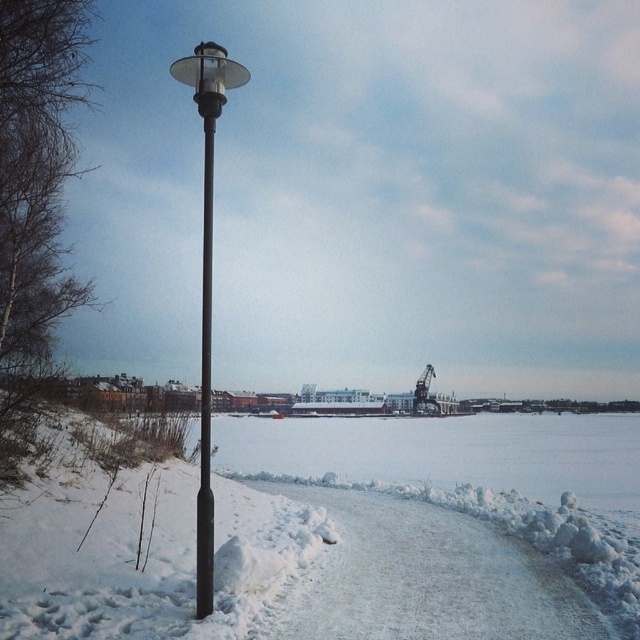
You are a delivery robot with a width of 0.8 meters. You need to move from the starting point to the delivery location, which is on the other side of the white fluffy snow at center and black matte pole at center. Can you pass through the space between them?

The white fluffy snow at center might be wider than black matte pole at center, so the space between them may be sufficient for the robot to pass through. However, since the exact width difference isn not specified, there is uncertainty. It is recommended to check the actual distance before proceeding.

You are a delivery person needing to walk from the black matte pole at center to the white fluffy snow at center. Which direction should you move relative to the pole?

You should move to the right relative to the black matte pole at center because the white fluffy snow at center is located to the right of the pole.

From the picture: You are standing at the center of the image and want to walk towards the white fluffy snow at center. In which direction should you move?

The white fluffy snow at center is already at the center of the image, so you don not need to move in any direction to reach it.